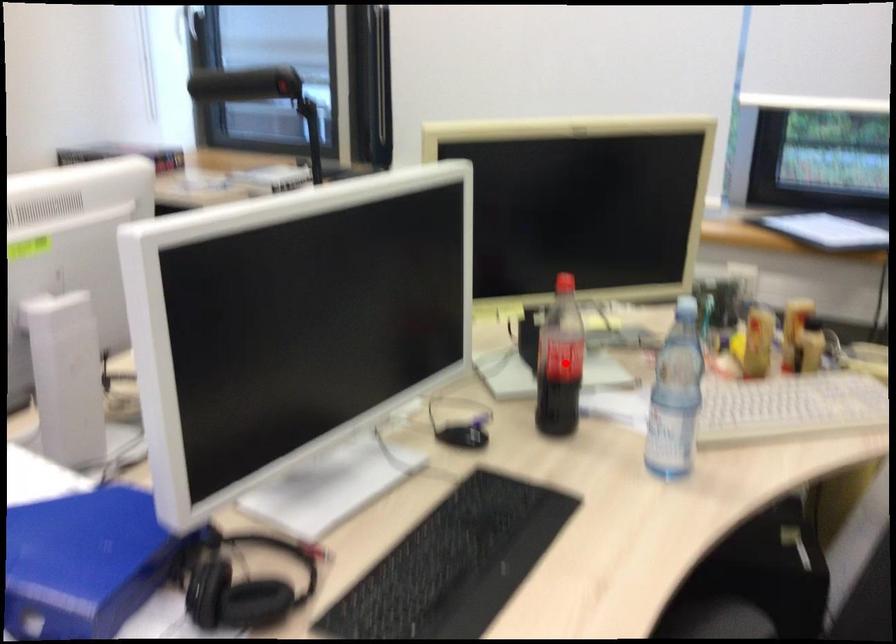
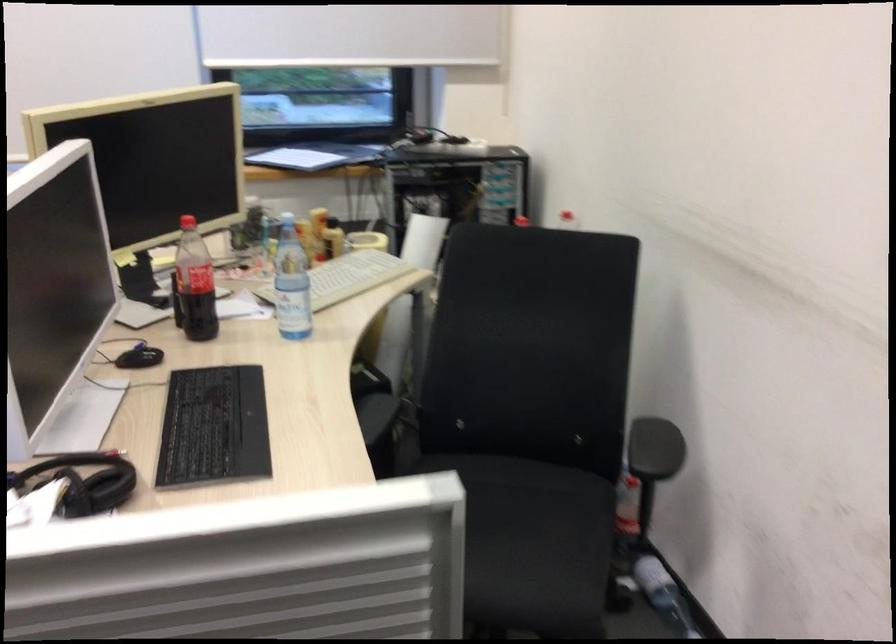
Question: I am providing you with two images of the same scene from different viewpoints. A red point is shown in image1. For the corresponding object point in image2, is it positioned nearer or farther from the camera?

Choices:
 (A) Nearer
 (B) Farther

Answer: (B)